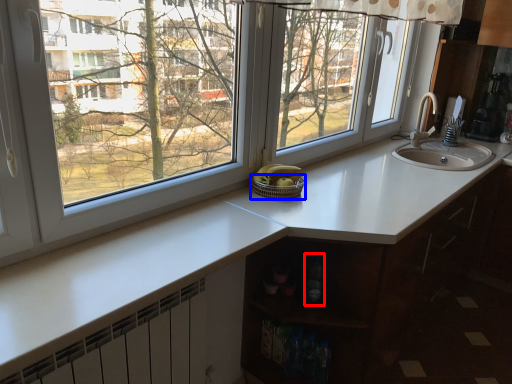
Question: Which point is closer to the camera, bottle (highlighted by a red box) or basket (highlighted by a blue box)?

Choices:
 (A) bottle
 (B) basket

Answer: (A)